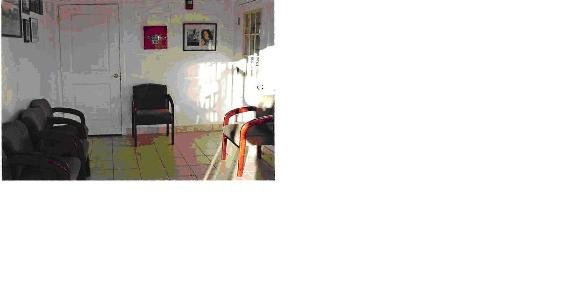
The image size is (576, 294). What are the coordinates of `red photo/art` in the screenshot? It's located at (159, 32).